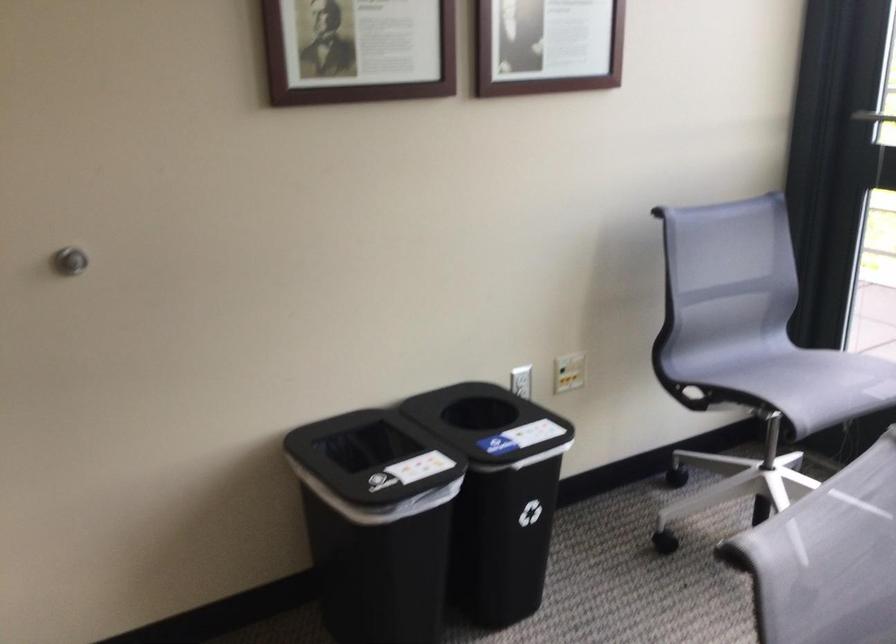
The width and height of the screenshot is (896, 644). Describe the element at coordinates (812, 382) in the screenshot. I see `the chair sitting surface` at that location.